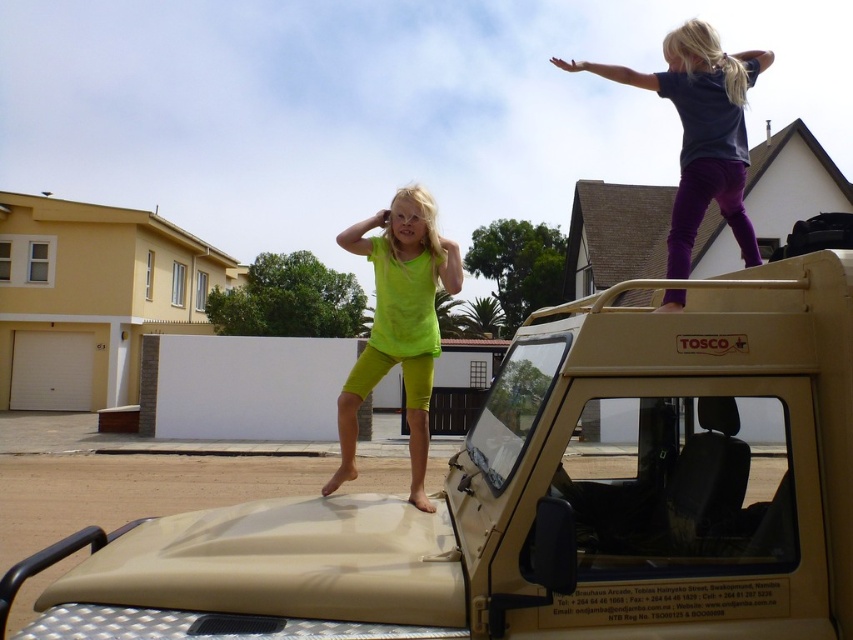
Question: Which is farther from the dark blue fabric at upper right?

Choices:
 (A) neon green fabric at center
 (B) tan matte vehicle at center

Answer: (B)

Question: Does neon green fabric at center appear over dark blue fabric at upper right?

Choices:
 (A) yes
 (B) no

Answer: (B)

Question: Which of the following is the farthest from the observer?

Choices:
 (A) dark blue fabric at upper right
 (B) tan matte vehicle at center
 (C) neon green fabric at center

Answer: (C)

Question: Which object is positioned farthest from the tan matte vehicle at center?

Choices:
 (A) dark blue fabric at upper right
 (B) neon green fabric at center

Answer: (A)

Question: Is tan matte vehicle at center below neon green fabric at center?

Choices:
 (A) yes
 (B) no

Answer: (B)

Question: Can you confirm if tan matte vehicle at center is positioned above dark blue fabric at upper right?

Choices:
 (A) yes
 (B) no

Answer: (B)